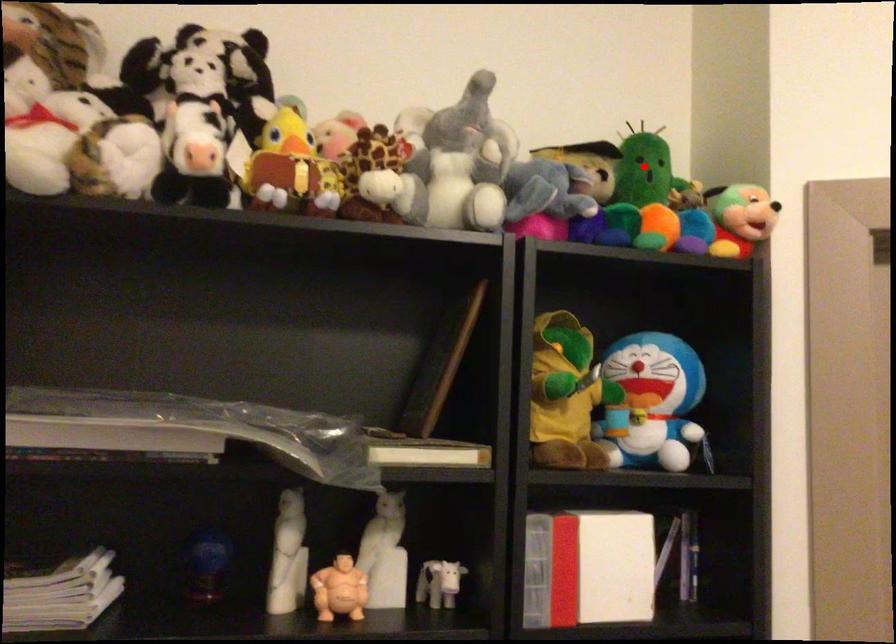
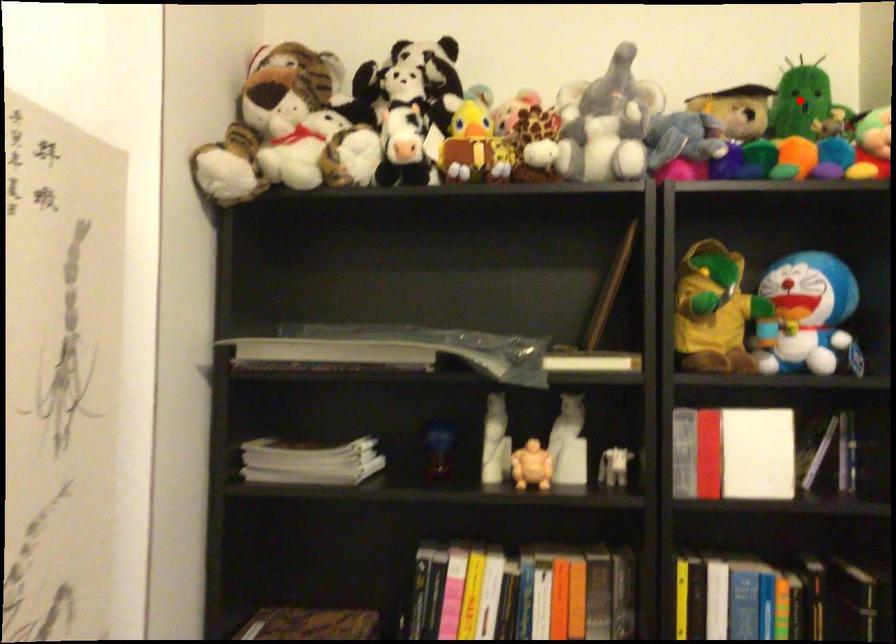
I am providing you with two images of the same scene from different viewpoints. A red point is marked on the first image and another point is marked on the second image. Is the red point in image1 aligned with the point shown in image2?

Yes